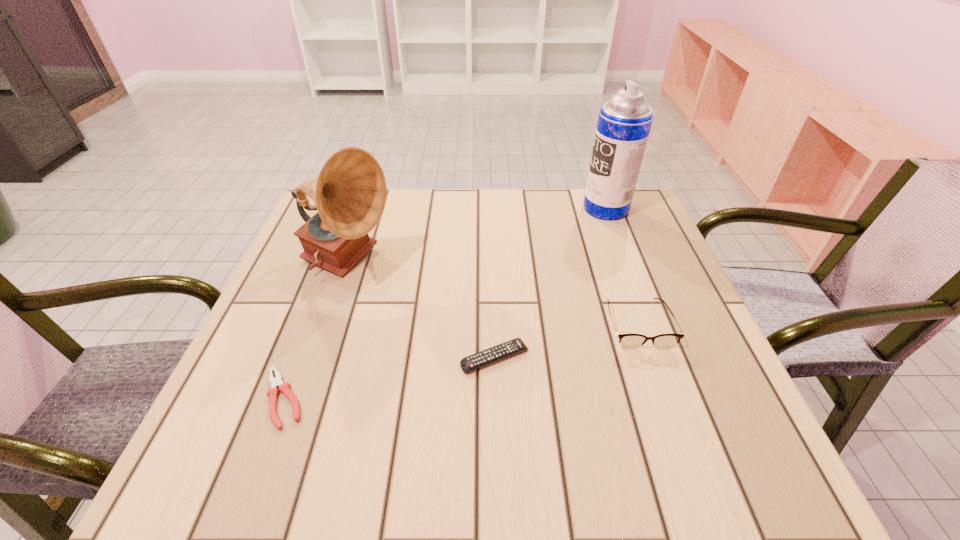
This screenshot has width=960, height=540. I want to click on vacant space that satisfies the following two spatial constraints: 1. on the horn of the remote control; 2. on the right side of the phonograph record, so click(x=316, y=357).

Identify the location of vacant area that satisfies the following two spatial constraints: 1. on the label side of the farthest object; 2. on the front side of the remote control. This screenshot has width=960, height=540. (662, 357).

Where is `free space that satisfies the following two spatial constraints: 1. on the back side of the remote control; 2. on the horn of the phonograph record`? Image resolution: width=960 pixels, height=540 pixels. free space that satisfies the following two spatial constraints: 1. on the back side of the remote control; 2. on the horn of the phonograph record is located at coordinates (492, 265).